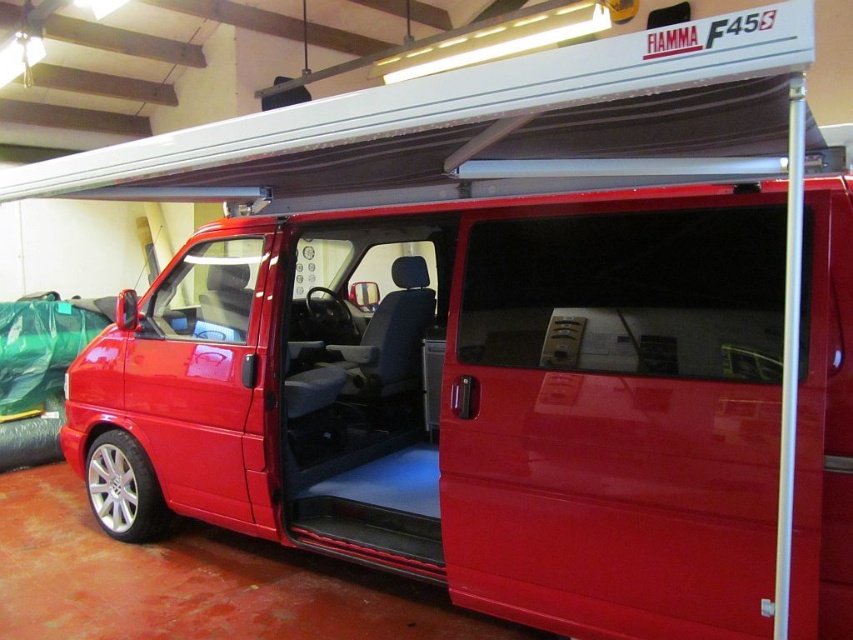
You are a delivery person trying to load a package that is 1 foot long into the space between the glossy red van at center and the glossy plastic door at center. Can the package fit in that space?

The space between the glossy red van at center and the glossy plastic door at center is 10.86 inches. Since 1 foot equals 12 inches, the package is longer than the available space. Therefore, the package cannot fit in that space.